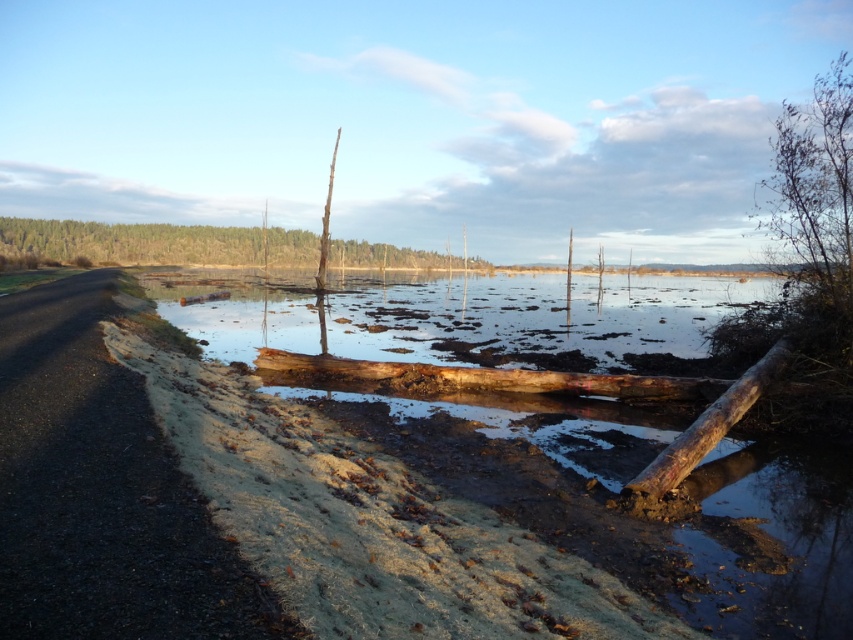
Question: Where is brown rough wood log at center located in relation to brown rough wood log at lower right in the image?

Choices:
 (A) left
 (B) right

Answer: (A)

Question: Does brown wood log at center appear under brown rough wood log at center?

Choices:
 (A) no
 (B) yes

Answer: (A)

Question: Based on their relative distances, which object is farther from the brown wood log at center?

Choices:
 (A) brown wood tree at upper center
 (B) bare branches at upper right

Answer: (A)

Question: Which is nearer to the bare branches at upper right?

Choices:
 (A) brown rough wood log at lower right
 (B) brown wood tree at upper center
 (C) brown rough wood log at center
 (D) brown wood log at center

Answer: (D)

Question: Which object appears farthest from the camera in this image?

Choices:
 (A) brown rough wood log at center
 (B) brown wood tree at upper center

Answer: (B)

Question: Where is brown rough wood log at center located in relation to brown rough wood log at lower right in the image?

Choices:
 (A) below
 (B) above

Answer: (B)